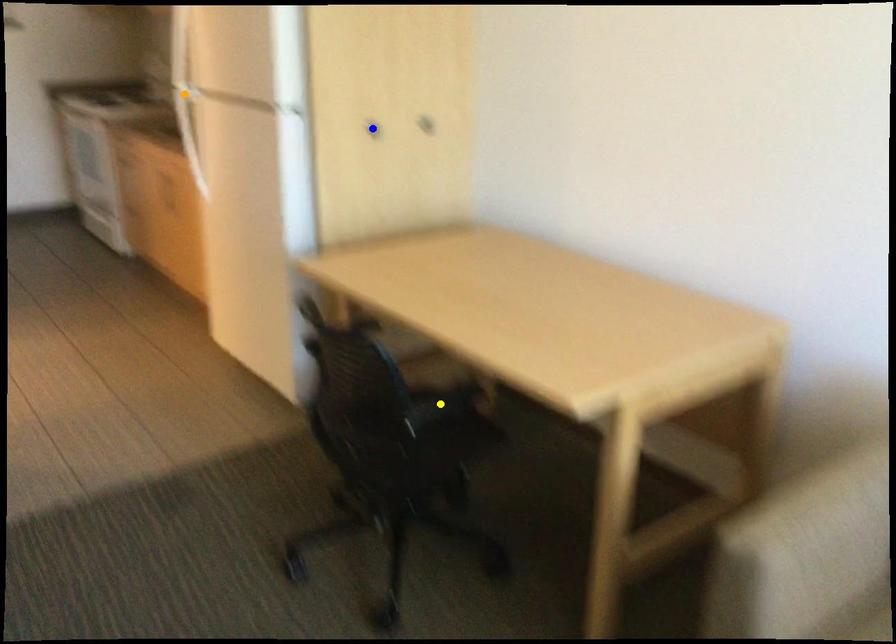
Order these from nearest to farthest:
A) yellow point
B) blue point
C) orange point

blue point → yellow point → orange point